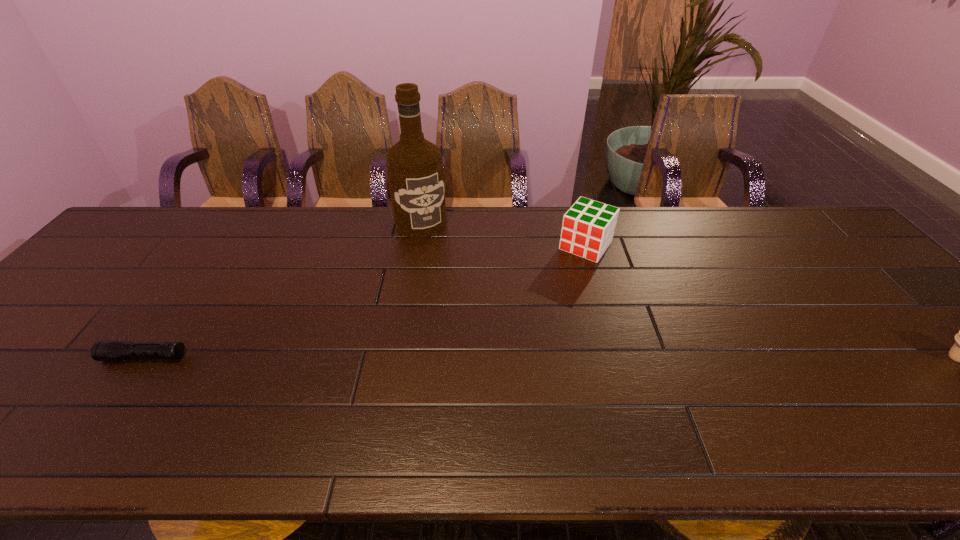
Locate an element on the screen. The image size is (960, 540). free space on the desktop that is between the shortest object and the rightmost object and is positioned on the label of the alcohol is located at coordinates (495, 357).

This screenshot has width=960, height=540. Identify the location of vacant space on the desktop that is between the flashlight and the second tallest object and is positioned on the red face of the cube. (502, 357).